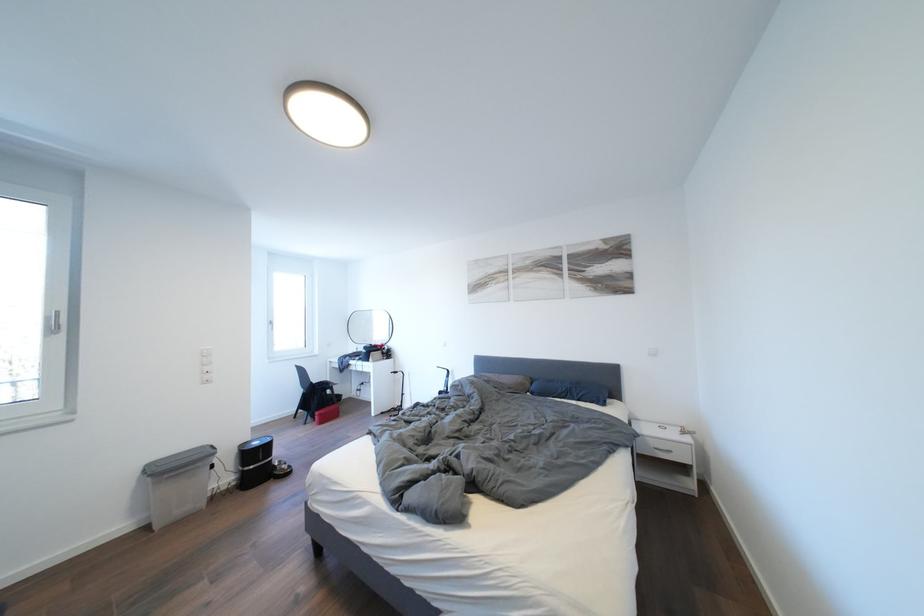
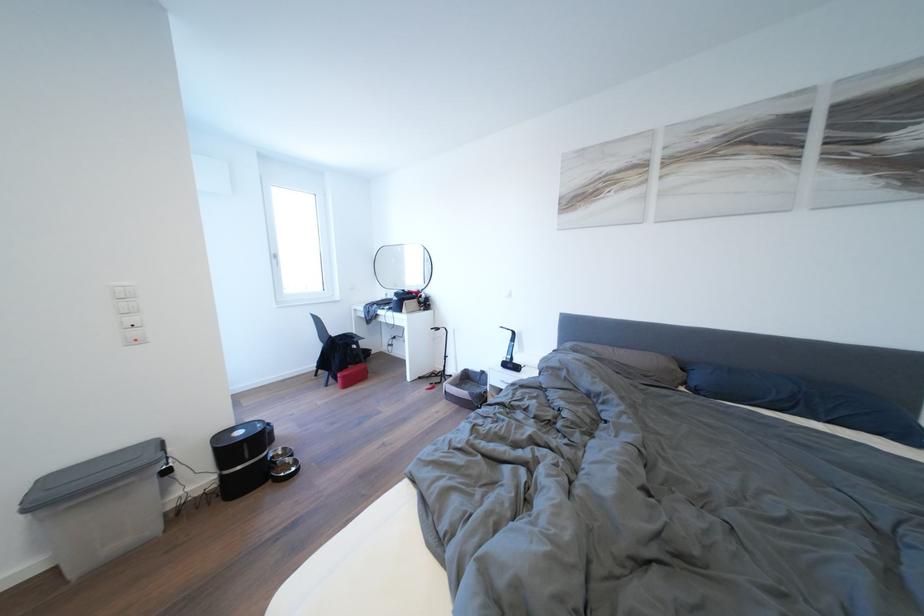
The point at (263, 448) is marked in the first image. Where is the corresponding point in the second image?

(248, 438)